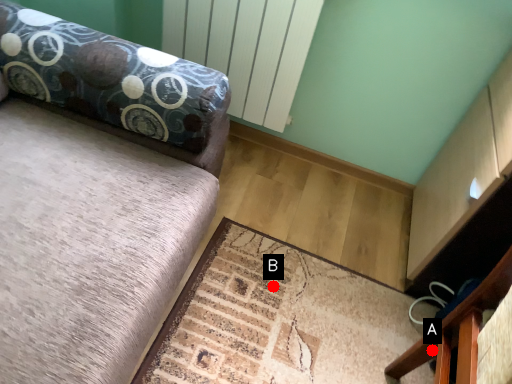
Question: Two points are circled on the image, labeled by A and B beside each circle. Among these points, which one is nearest to the camera?

Choices:
 (A) A is closer
 (B) B is closer

Answer: (A)